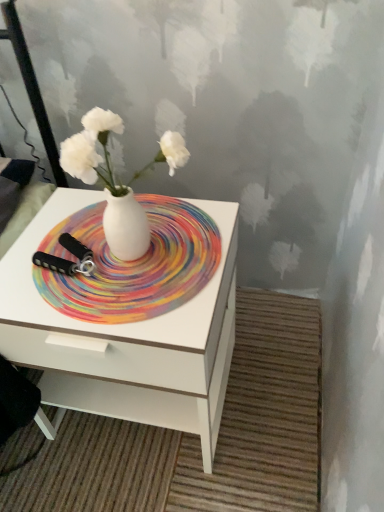
Question: Considering the relative sizes of white glossy vase at center and rainbow swirl placemat at center in the image provided, is white glossy vase at center bigger than rainbow swirl placemat at center?

Choices:
 (A) no
 (B) yes

Answer: (B)

Question: Can you confirm if white glossy vase at center is wider than rainbow swirl placemat at center?

Choices:
 (A) no
 (B) yes

Answer: (A)

Question: From a real-world perspective, is white glossy vase at center located higher than rainbow swirl placemat at center?

Choices:
 (A) no
 (B) yes

Answer: (B)

Question: Is white glossy vase at center not near rainbow swirl placemat at center?

Choices:
 (A) no
 (B) yes

Answer: (A)

Question: Is white glossy vase at center aimed at rainbow swirl placemat at center?

Choices:
 (A) no
 (B) yes

Answer: (A)

Question: Is point (130, 240) closer or farther from the camera than point (57, 274)?

Choices:
 (A) closer
 (B) farther

Answer: (A)

Question: From a real-world perspective, is white glossy vase at center positioned above or below rainbow swirl placemat at center?

Choices:
 (A) below
 (B) above

Answer: (B)

Question: In terms of size, does white glossy vase at center appear bigger or smaller than rainbow swirl placemat at center?

Choices:
 (A) small
 (B) big

Answer: (B)

Question: From the image's perspective, is white glossy vase at center located above or below rainbow swirl placemat at center?

Choices:
 (A) above
 (B) below

Answer: (A)

Question: Is white glossy vase at center bigger or smaller than white glossy nightstand at center?

Choices:
 (A) big
 (B) small

Answer: (B)

Question: From a real-world perspective, relative to white glossy nightstand at center, is white glossy vase at center vertically above or below?

Choices:
 (A) below
 (B) above

Answer: (B)

Question: Is point (124, 248) closer or farther from the camera than point (213, 399)?

Choices:
 (A) closer
 (B) farther

Answer: (A)

Question: From the image's perspective, is white glossy vase at center positioned above or below white glossy nightstand at center?

Choices:
 (A) below
 (B) above

Answer: (B)

Question: From the image's perspective, is white glossy nightstand at center located above or below white glossy vase at center?

Choices:
 (A) below
 (B) above

Answer: (A)

Question: Considering their positions, is white glossy nightstand at center located in front of or behind white glossy vase at center?

Choices:
 (A) behind
 (B) front

Answer: (A)